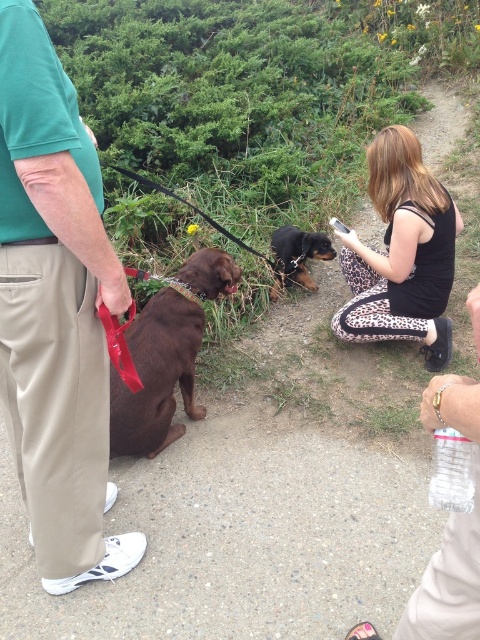
Is the position of black leopard print pants at center less distant than that of matte brown dog at left?

No, black leopard print pants at center is further to the viewer.

Does black leopard print pants at center have a lesser width compared to matte brown dog at left?

In fact, black leopard print pants at center might be wider than matte brown dog at left.

Does point (430, 317) come closer to viewer compared to point (145, 355)?

No, it is not.

At what (x,y) coordinates should I click in order to perform the action: click on black leopard print pants at center. Please return your answer as a coordinate pair (x, y). The width and height of the screenshot is (480, 640). Looking at the image, I should click on (x=402, y=253).

Is green cotton shirt at left to the right of black and tan fur at center from the viewer's perspective?

No, green cotton shirt at left is not to the right of black and tan fur at center.

Where is `green cotton shirt at left`? The image size is (480, 640). green cotton shirt at left is located at coordinates (56, 310).

Is green cotton shirt at left above black leopard print pants at center?

Actually, green cotton shirt at left is below black leopard print pants at center.

Which is in front, point (40, 54) or point (360, 273)?

Point (40, 54)

Who is more forward, (50, 148) or (447, 241)?

Point (50, 148)

Find the location of `green cotton shirt at left`. green cotton shirt at left is located at coordinates (56, 310).